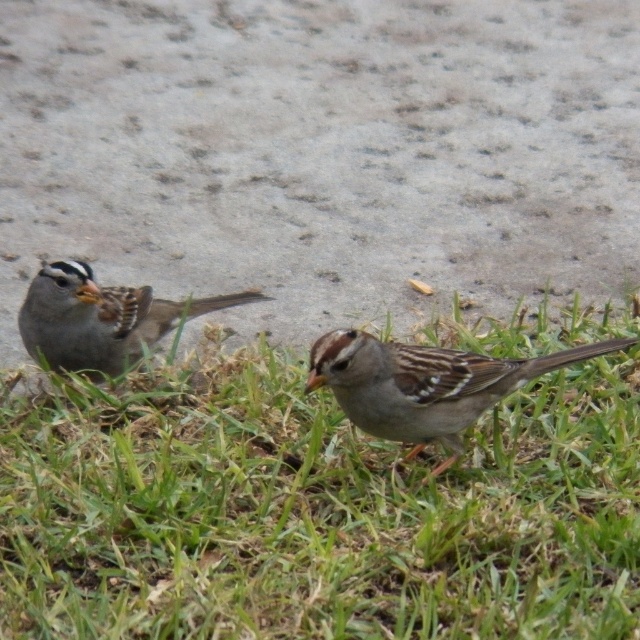
You are a small robot with a 30 cm long arm. You need to reach the green grass at lower center from where you are standing next to the brown speckled sparrow at center. Can your arm reach it?

The green grass at lower center is 36.19 centimeters away from the brown speckled sparrow at center. Since your arm is only 30 cm long, it cannot reach the green grass at lower center from the sparrow.